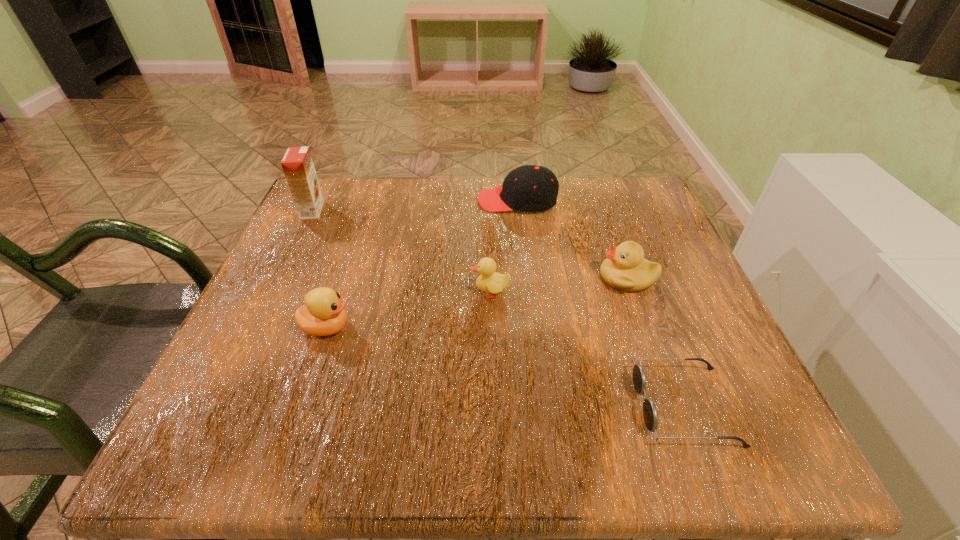
Image resolution: width=960 pixels, height=540 pixels. Find the location of `vacant space in between the second duckling from left to right and the leftmost duckling`. vacant space in between the second duckling from left to right and the leftmost duckling is located at coordinates (408, 310).

The image size is (960, 540). What are the coordinates of `free space between the nearest object and the tallest object` in the screenshot? It's located at (498, 308).

The height and width of the screenshot is (540, 960). What are the coordinates of `unoccupied area between the cap and the rightmost duckling` in the screenshot? It's located at (572, 239).

Where is `vacant space that is in between the rightmost duckling and the orange juice`? The image size is (960, 540). vacant space that is in between the rightmost duckling and the orange juice is located at coordinates (469, 244).

Image resolution: width=960 pixels, height=540 pixels. Find the location of `free area in between the tallest object and the second duckling from right to left`. free area in between the tallest object and the second duckling from right to left is located at coordinates (400, 252).

What are the coordinates of `free space between the leftmost object and the second duckling from right to left` in the screenshot? It's located at (400, 252).

Image resolution: width=960 pixels, height=540 pixels. In order to click on unoccupied position between the rightmost duckling and the nearest object in this screenshot , I will do `click(656, 342)`.

This screenshot has width=960, height=540. What are the coordinates of `free space that is in between the rightmost duckling and the nearest object` in the screenshot? It's located at (656, 342).

The image size is (960, 540). In order to click on vacant space that's between the rightmost duckling and the nearest duckling in this screenshot , I will do `click(477, 302)`.

In order to click on unoccupied area between the cap and the rightmost duckling in this screenshot , I will do `click(572, 239)`.